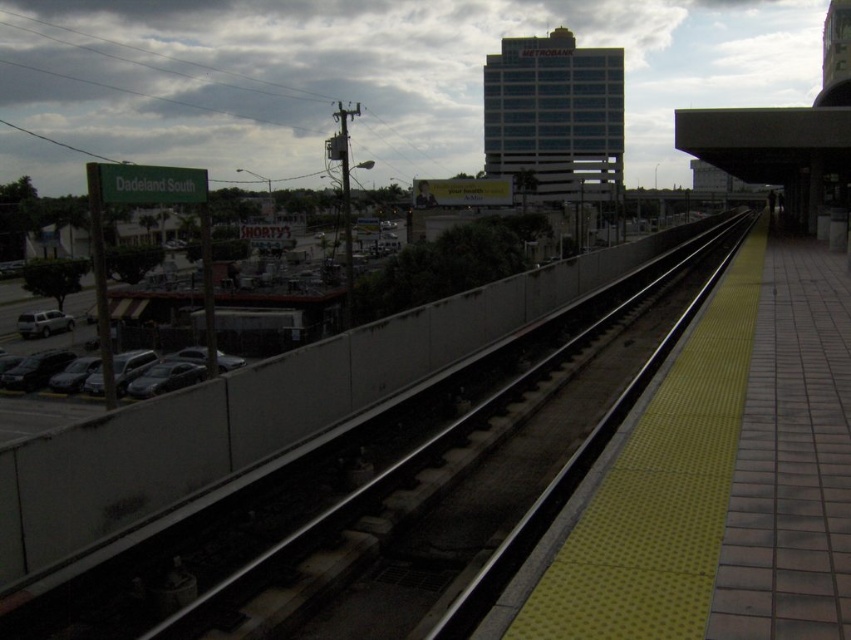
Which is more to the left, black asphalt train track at center or satin silver suv at left?

Positioned to the left is satin silver suv at left.

Is point (553, 316) more distant than point (66, 326)?

No, it is in front of (66, 326).

Identify the location of black asphalt train track at center. (313, 477).

Can you confirm if black asphalt train track at center is positioned to the right of dark gray metallic car at left?

Indeed, black asphalt train track at center is positioned on the right side of dark gray metallic car at left.

The width and height of the screenshot is (851, 640). Identify the location of black asphalt train track at center. (313, 477).

Between point (54, 602) and point (113, 360), which one is positioned in front?

Point (54, 602)

This screenshot has height=640, width=851. I want to click on black asphalt train track at center, so click(313, 477).

Consider the image. Does dark gray metallic car at left have a greater width compared to satin silver suv at left?

Indeed, dark gray metallic car at left has a greater width compared to satin silver suv at left.

Image resolution: width=851 pixels, height=640 pixels. What do you see at coordinates (151, 365) in the screenshot?
I see `dark gray metallic car at left` at bounding box center [151, 365].

This screenshot has width=851, height=640. Find the location of `dark gray metallic car at left`. dark gray metallic car at left is located at coordinates (151, 365).